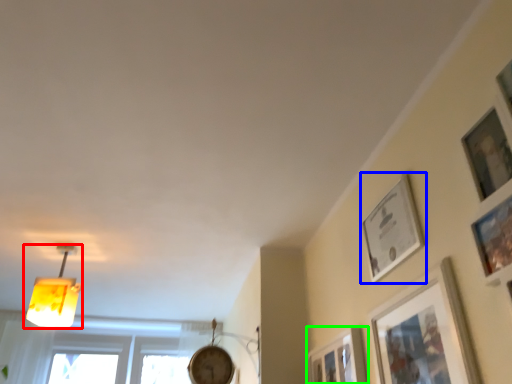
Question: Considering the real-world distances, which object is closest to lamp (highlighted by a red box)? picture frame (highlighted by a blue box) or picture frame (highlighted by a green box).

Choices:
 (A) picture frame
 (B) picture frame

Answer: (B)